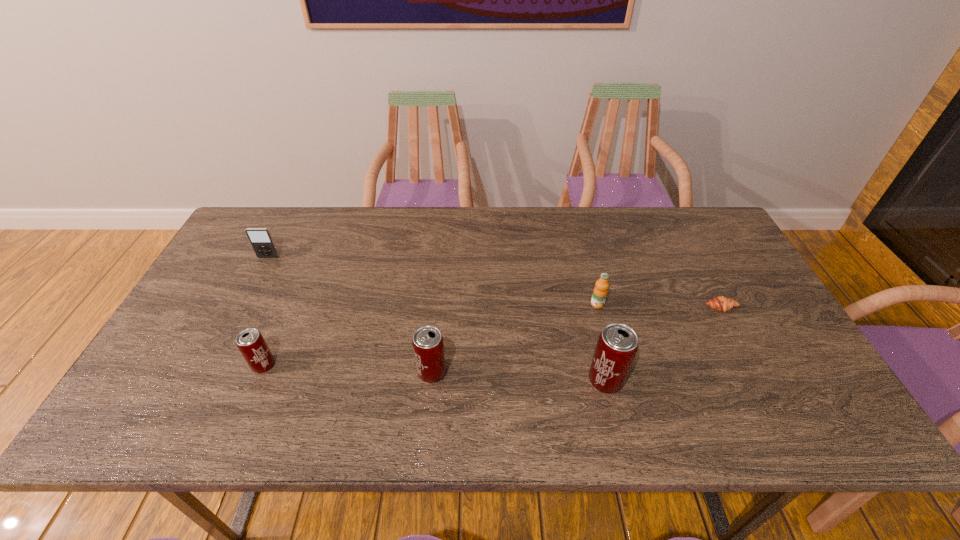
Image resolution: width=960 pixels, height=540 pixels. I want to click on vacant region that satisfies the following two spatial constraints: 1. on the front side of the tallest object; 2. on the right side of the leftmost beer can, so click(x=257, y=381).

You are a GUI agent. You are given a task and a screenshot of the screen. Output one action in this format:
    pyautogui.click(x=<x>, y=<y>)
    Task: Click on the vacant space that satisfies the following two spatial constraints: 1. on the front-facing side of the leftmost beer can; 2. on the left side of the iPod
    The width and height of the screenshot is (960, 540).
    Given the screenshot: What is the action you would take?
    pyautogui.click(x=212, y=365)